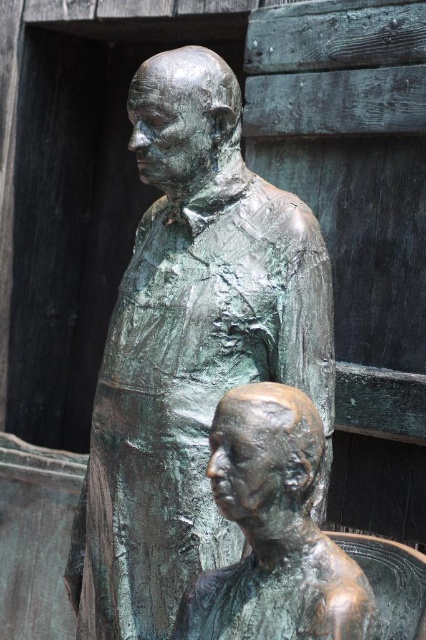
You are an art curator examining two statues in a gallery. You need to determine which statue is closer to the entrance. The statues are the green patina statue at center and the bronze statue at lower center. Based on their positions, which one is closer to the entrance?

The green patina statue at center is closer to the entrance because it is further to the viewer than the bronze statue at lower center, indicating it is positioned nearer to the entrance where visitors first see it.

You have a 15 inch wide box that you need to place between the green patina statue at center and the bronze statue at lower center. Can the box fit between them without touching either statue?

The distance between the green patina statue at center and the bronze statue at lower center is 14.59 inches. Since the box is 15 inches wide, it cannot fit between them without overlapping or touching the statues.

You are an art curator examining two statues in a gallery. You need to determine which statue is taller between the green patina statue at center and the bronze statue at lower center. Which one is taller?

The green patina statue at center is taller than the bronze statue at lower center according to the description provided.